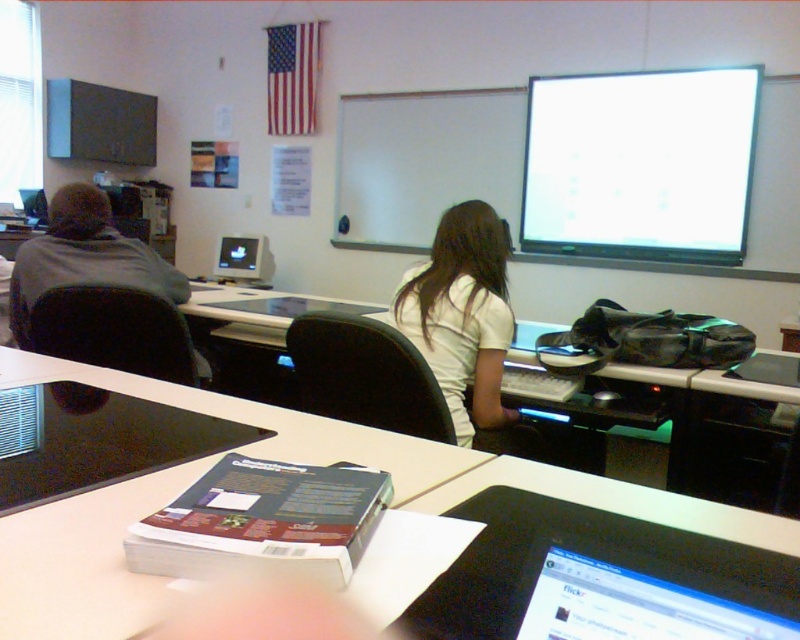
You are a student who needs to access your textbook. You are currently sitting at the desk where the black glossy laptop at lower right and the gray fabric jacket at left are located. Which object is closer to your left side?

The gray fabric jacket at left is closer to your left side because it is positioned on the left side of the black glossy laptop at lower right.

You are a student in the classroom and need to locate your black glossy laptop at lower right. According to the coordinates provided, where should you look?

You should look at point (x=634, y=605) to find the black glossy laptop at lower right.

You are a student sitting in the classroom and need to access your laptop which is on the white plastic computer desk at center. However, there is a gray fabric jacket at left in the way. Can you reach the laptop without moving the jacket?

The white plastic computer desk at center is located below the gray fabric jacket at left, so the jacket is above the desk. Since the jacket is not on the desk itself but above it, you can likely reach the laptop without moving the jacket.